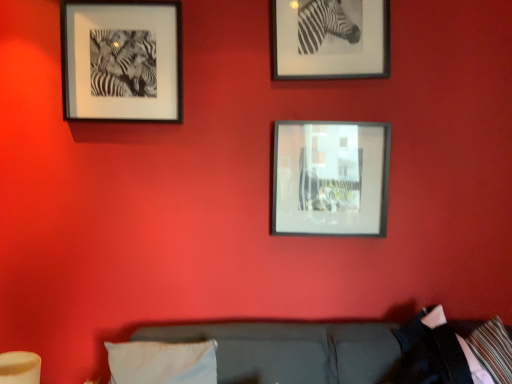
Question: Can you confirm if metallic silver frame at center, arranged as the third picture frame when viewed from the left, is positioned to the right of black matte picture frame at upper left, which is the 3th picture frame from right to left?

Choices:
 (A) no
 (B) yes

Answer: (B)

Question: From a real-world perspective, is metallic silver frame at center, the 1th picture frame positioned from the right, beneath black matte picture frame at upper left, acting as the first picture frame starting from the left?

Choices:
 (A) no
 (B) yes

Answer: (B)

Question: Considering the relative sizes of metallic silver frame at center, arranged as the third picture frame when viewed from the left, and black matte picture frame at upper left, which is the 3th picture frame from right to left, in the image provided, is metallic silver frame at center, arranged as the third picture frame when viewed from the left, bigger than black matte picture frame at upper left, which is the 3th picture frame from right to left,?

Choices:
 (A) yes
 (B) no

Answer: (B)

Question: From a real-world perspective, is metallic silver frame at center, the 1th picture frame positioned from the right, positioned over black matte picture frame at upper left, acting as the first picture frame starting from the left, based on gravity?

Choices:
 (A) yes
 (B) no

Answer: (B)

Question: Could black matte picture frame at upper left, acting as the first picture frame starting from the left, be considered to be inside metallic silver frame at center, the 1th picture frame positioned from the right?

Choices:
 (A) no
 (B) yes

Answer: (A)

Question: Is metallic silver frame at center, the 1th picture frame positioned from the right, at the left side of black matte picture frame at upper left, which is the 3th picture frame from right to left?

Choices:
 (A) no
 (B) yes

Answer: (A)

Question: Does metallic silver frame at upper right, the 2th picture frame from the right, turn towards metallic silver frame at center, the 1th picture frame positioned from the right?

Choices:
 (A) yes
 (B) no

Answer: (B)

Question: Does metallic silver frame at upper right, the 2th picture frame from the right, come in front of metallic silver frame at center, arranged as the third picture frame when viewed from the left?

Choices:
 (A) no
 (B) yes

Answer: (B)

Question: Is the position of metallic silver frame at upper right, the 2th picture frame from the right, more distant than that of metallic silver frame at center, the 1th picture frame positioned from the right?

Choices:
 (A) yes
 (B) no

Answer: (B)

Question: Is metallic silver frame at upper right, the 2th picture frame from the right, thinner than metallic silver frame at center, the 1th picture frame positioned from the right?

Choices:
 (A) no
 (B) yes

Answer: (B)

Question: From a real-world perspective, is metallic silver frame at upper right, the 2th picture frame from the right, physically above metallic silver frame at center, the 1th picture frame positioned from the right?

Choices:
 (A) yes
 (B) no

Answer: (A)

Question: From the image's perspective, is metallic silver frame at upper right, the 2th picture frame from the right, over metallic silver frame at center, arranged as the third picture frame when viewed from the left?

Choices:
 (A) no
 (B) yes

Answer: (B)

Question: From a real-world perspective, is metallic silver frame at center, arranged as the third picture frame when viewed from the left, physically above metallic silver frame at upper right, marked as the second picture frame in a left-to-right arrangement?

Choices:
 (A) no
 (B) yes

Answer: (A)